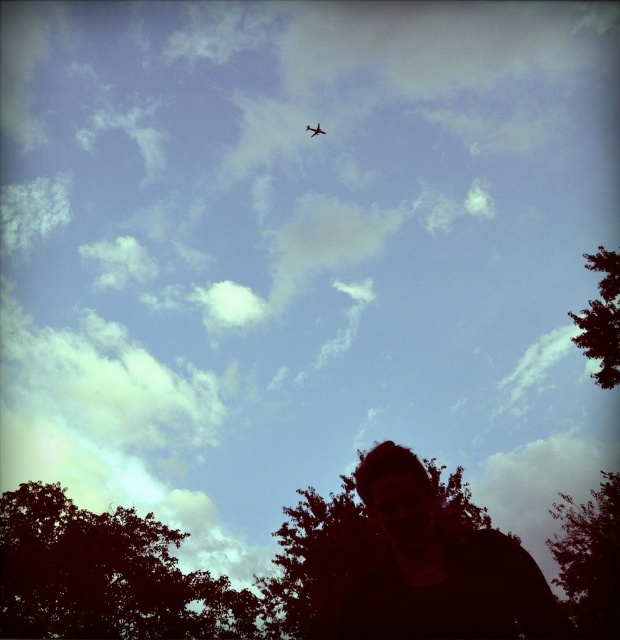
You are standing at the center of the image and want to walk to both the dark green leafy tree at lower left and the dark green leafy tree at lower right. Which tree will require you to walk a shorter distance?

The dark green leafy tree at lower left is 34.42 meters away from the dark green leafy tree at lower right. Since you are standing at the center, the distance to each tree would depend on their positions. However, without knowing the exact positions relative to the center, it is impossible to determine which requires a shorter walk.

You are standing in the park and see the dark green leafy tree at lower right and the metallic airplane at upper center. Which object is positioned to the right side of the other?

The dark green leafy tree at lower right is to the right of the metallic airplane at upper center.